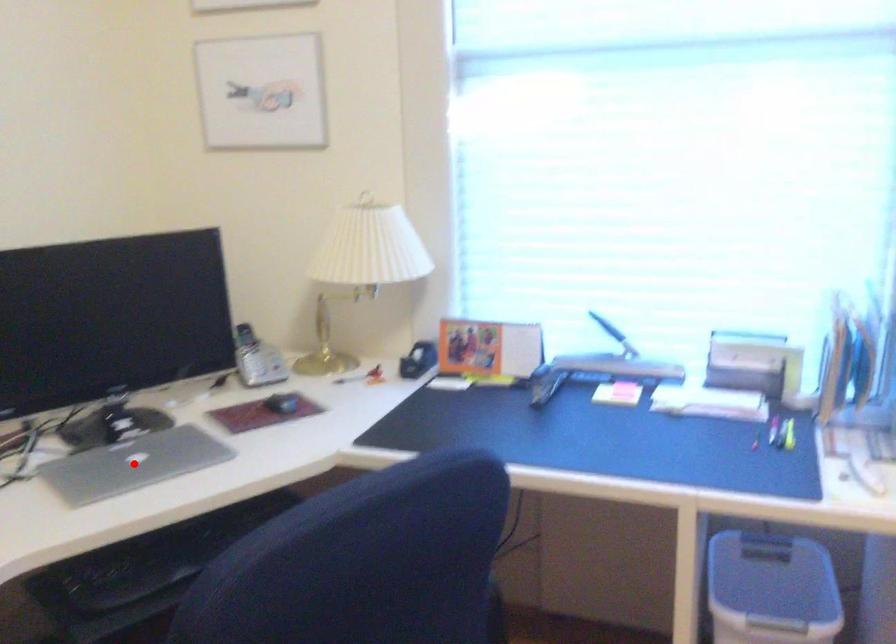
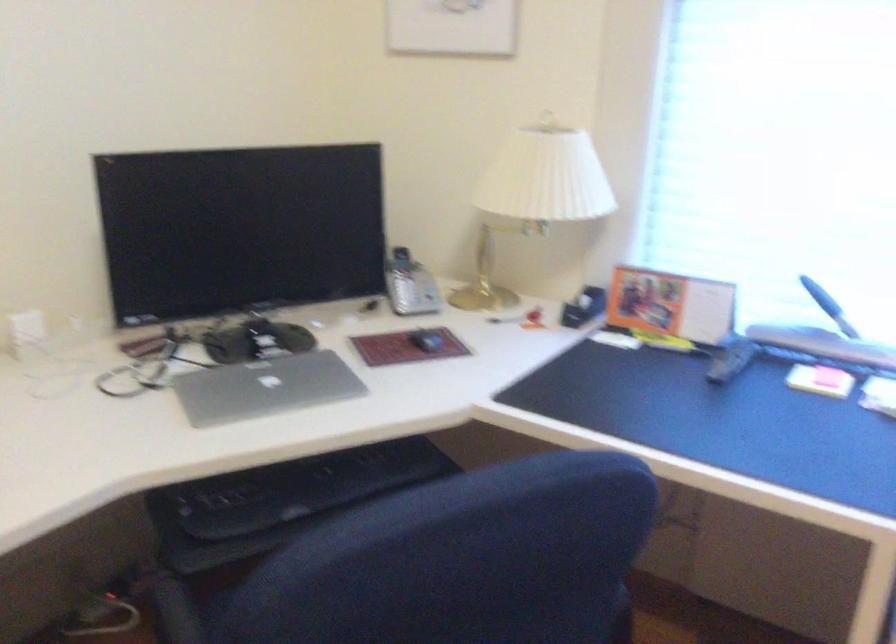
The point at the highlighted location is marked in the first image. Where is the corresponding point in the second image?

(264, 386)